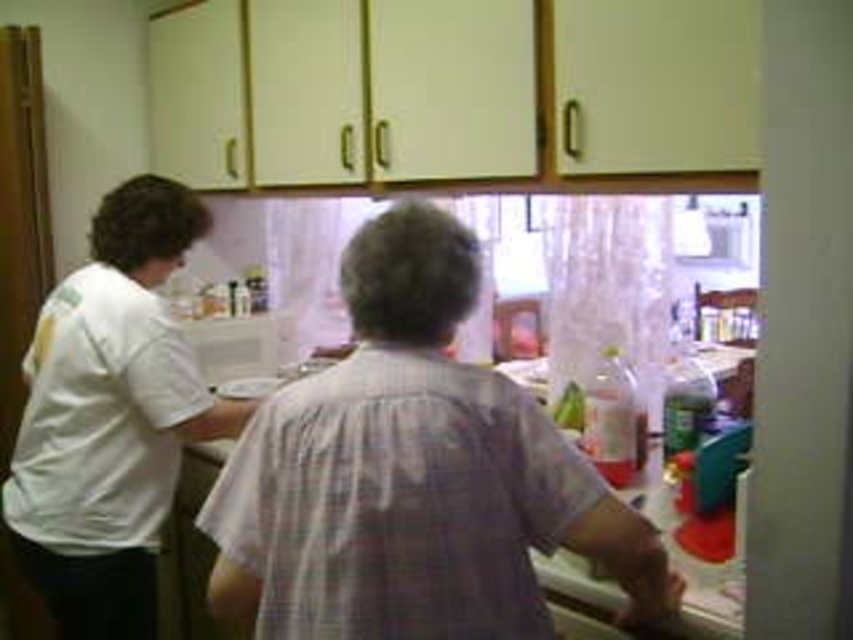
Does white cotton shirt at center appear on the right side of white matte shirt at left?

Correct, you'll find white cotton shirt at center to the right of white matte shirt at left.

Which is behind, point (426, 589) or point (119, 550)?

The point (119, 550) is behind.

Where is `white cotton shirt at center`? The height and width of the screenshot is (640, 853). white cotton shirt at center is located at coordinates (412, 476).